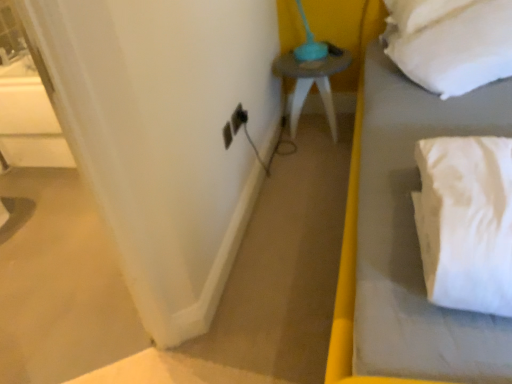
Question: Can you confirm if matte gray side table at center is wider than white fabric curtain at left?

Choices:
 (A) no
 (B) yes

Answer: (B)

Question: Can you confirm if matte gray side table at center is shorter than white fabric curtain at left?

Choices:
 (A) yes
 (B) no

Answer: (A)

Question: Can you confirm if matte gray side table at center is smaller than white fabric curtain at left?

Choices:
 (A) no
 (B) yes

Answer: (A)

Question: Is matte gray side table at center facing away from white fabric curtain at left?

Choices:
 (A) yes
 (B) no

Answer: (B)

Question: Is matte gray side table at center at the left side of white fabric curtain at left?

Choices:
 (A) no
 (B) yes

Answer: (A)

Question: Based on their sizes in the image, would you say black plastic electric outlet at lower center is bigger or smaller than white fabric curtain at left?

Choices:
 (A) big
 (B) small

Answer: (B)

Question: From the image's perspective, is black plastic electric outlet at lower center located above or below white fabric curtain at left?

Choices:
 (A) above
 (B) below

Answer: (A)

Question: Looking at their shapes, would you say black plastic electric outlet at lower center is wider or thinner than white fabric curtain at left?

Choices:
 (A) thin
 (B) wide

Answer: (A)

Question: From a real-world perspective, is black plastic electric outlet at lower center positioned above or below white fabric curtain at left?

Choices:
 (A) above
 (B) below

Answer: (B)

Question: Is black plastic electric outlet at lower center wider or thinner than white soft bed at right?

Choices:
 (A) thin
 (B) wide

Answer: (A)

Question: In the image, is black plastic electric outlet at lower center on the left side or the right side of white soft bed at right?

Choices:
 (A) right
 (B) left

Answer: (B)

Question: Considering the positions of black plastic electric outlet at lower center and white soft bed at right in the image, is black plastic electric outlet at lower center bigger or smaller than white soft bed at right?

Choices:
 (A) big
 (B) small

Answer: (B)

Question: In the image, is black plastic electric outlet at lower center positioned in front of or behind white soft bed at right?

Choices:
 (A) behind
 (B) front

Answer: (A)

Question: Based on their positions, is white soft pillow at upper right located to the left or right of white soft bed at right?

Choices:
 (A) left
 (B) right

Answer: (B)

Question: Looking at the image, does white soft pillow at upper right seem bigger or smaller compared to white soft bed at right?

Choices:
 (A) big
 (B) small

Answer: (B)